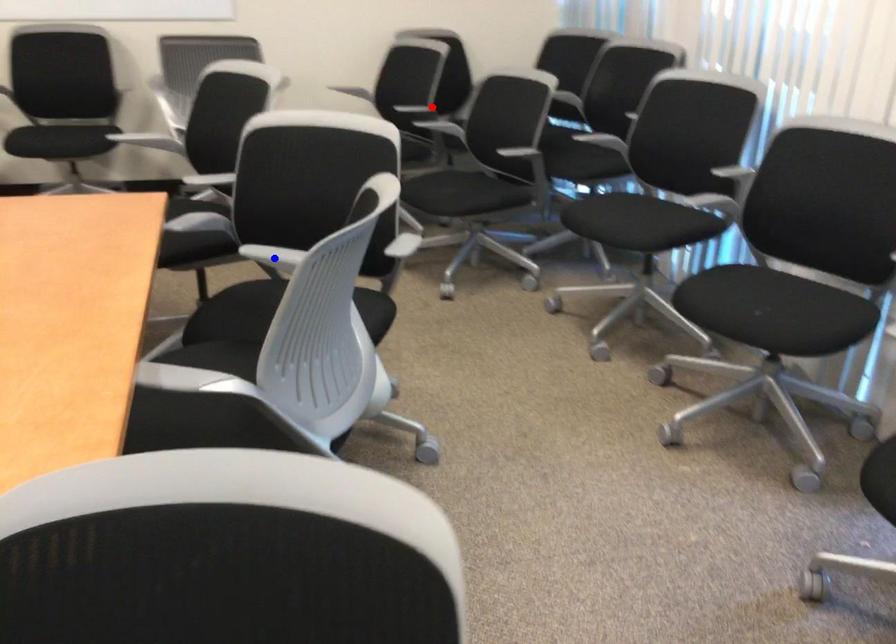
Question: Which of the two points in the image is closer to the camera?

Choices:
 (A) Blue point is closer.
 (B) Red point is closer.

Answer: (A)